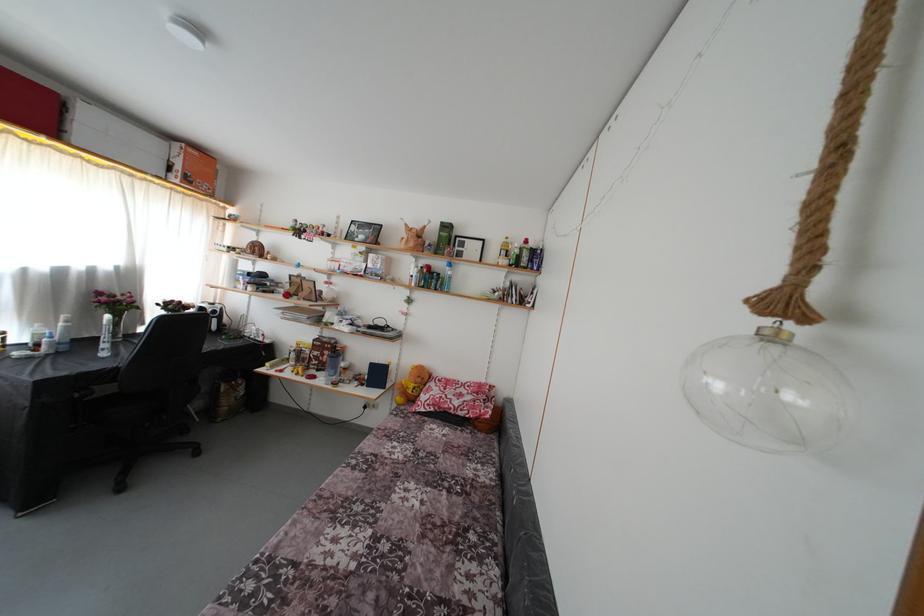
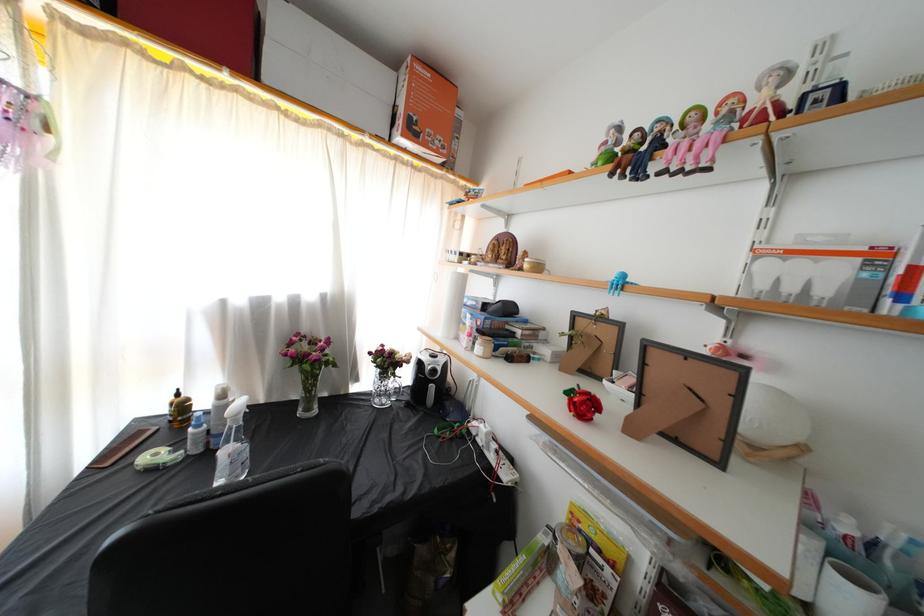
In the second image, find the point that corresponds to the point at 304,238 in the first image.

(638, 161)